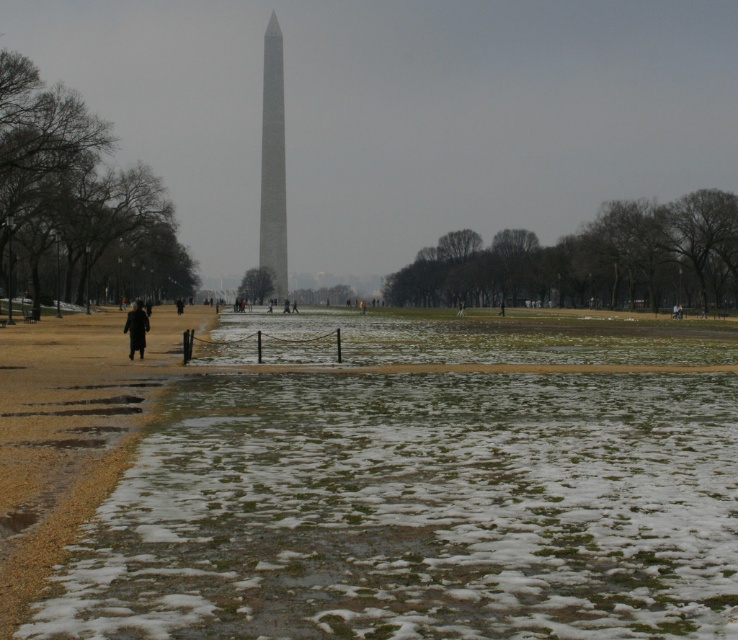
Question: Does smooth gray obelisk at center have a smaller size compared to black coat at center?

Choices:
 (A) no
 (B) yes

Answer: (A)

Question: Does smooth gray obelisk at center have a larger size compared to black coat at center?

Choices:
 (A) no
 (B) yes

Answer: (B)

Question: Can you confirm if smooth gray obelisk at center is thinner than black coat at center?

Choices:
 (A) yes
 (B) no

Answer: (B)